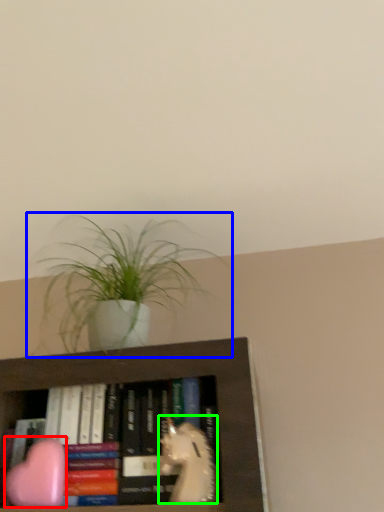
Question: Considering the real-world distances, which object is farthest from animal (highlighted by a red box)? houseplant (highlighted by a blue box) or animal (highlighted by a green box)?

Choices:
 (A) houseplant
 (B) animal

Answer: (A)